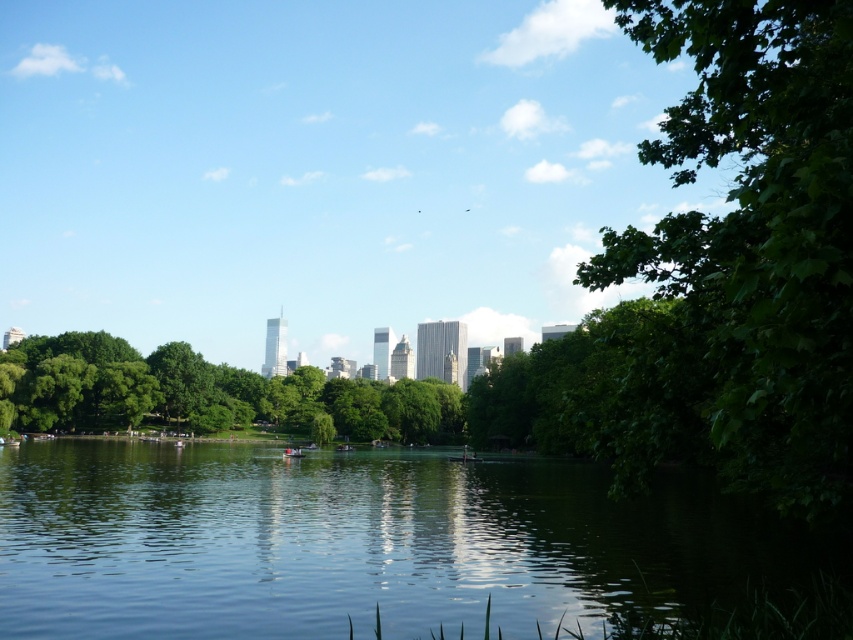
In the scene shown: You are standing at the center of the park and want to take a photo of the green leafy tree at right. Which direction should you face to capture it in your frame?

The green leafy tree at right is located at the right side of the scene, so you should face towards the right direction to capture it in your photo.

You are a park ranger planning to install a bench between the green reflective water at center and the green leafy tree at right. The bench requires a minimum of 3 meters of space. Can you place the bench between them?

The distance between the green reflective water at center and the green leafy tree at right is 26.08 meters, which is more than enough to accommodate a bench requiring 3 meters of space.